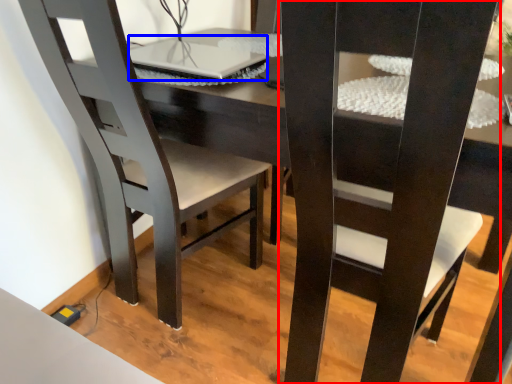
Question: Which object is closer to the camera taking this photo, chair (highlighted by a red box) or laptop (highlighted by a blue box)?

Choices:
 (A) chair
 (B) laptop

Answer: (A)